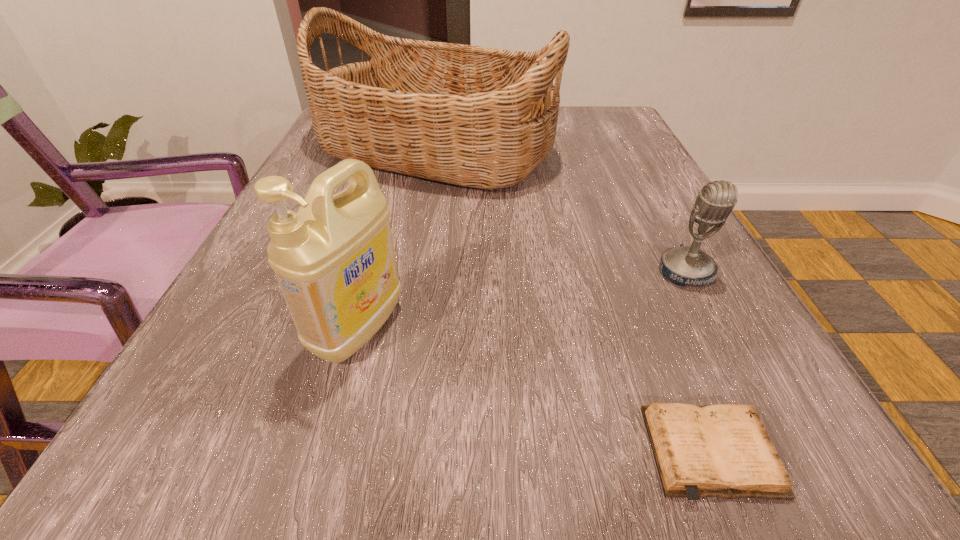
I want to click on free space at the right edge of the desktop, so click(670, 357).

In the image, there is a desktop. Where is `vacant space at the near left corner`? This screenshot has width=960, height=540. vacant space at the near left corner is located at coordinates (159, 451).

In the image, there is a desktop. Identify the location of vacant space at the near right corner. The image size is (960, 540). (794, 496).

Find the location of `free point between the third tallest object and the farthest object`. free point between the third tallest object and the farthest object is located at coordinates (561, 211).

Where is `free space that is in between the shortest object and the detergent`? free space that is in between the shortest object and the detergent is located at coordinates (535, 391).

This screenshot has height=540, width=960. What are the coordinates of `free space between the detergent and the third tallest object` in the screenshot? It's located at (522, 300).

You are a GUI agent. You are given a task and a screenshot of the screen. Output one action in this format:
    pyautogui.click(x=<x>, y=<y>)
    Task: Click on the vacant area that lies between the basket and the microphone
    Image resolution: width=960 pixels, height=540 pixels.
    Given the screenshot: What is the action you would take?
    pyautogui.click(x=561, y=211)

What are the coordinates of `vacant area between the detergent and the third tallest object` in the screenshot? It's located at (522, 300).

Where is `vacant area that lies between the farthest object and the detergent`? Image resolution: width=960 pixels, height=540 pixels. vacant area that lies between the farthest object and the detergent is located at coordinates (397, 239).

This screenshot has height=540, width=960. What are the coordinates of `vacant area that lies between the diary and the basket` in the screenshot? It's located at (574, 302).